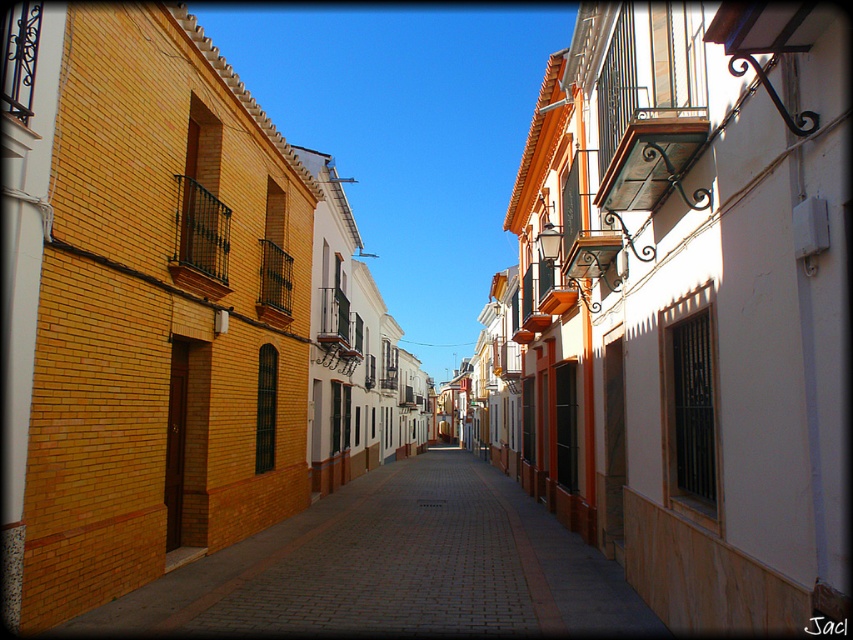
You are a tourist walking along the narrow cobblestone alleyway in this Mediterranean town. You notice a white textured wall at center and a brick pavement at center. Which object is located to the right of the other?

The white textured wall at center is positioned on the right side of brick pavement at center, so the white textured wall at center is to the right of the brick pavement at center.

You are standing on the cobblestone alleyway in the Mediterranean town. You want to take a photo of the white textured wall at center. Where should you position yourself to capture it in the frame?

To capture the white textured wall at center in your photo, position yourself so that the camera is aimed at the coordinates approximately at point 0.477 on the horizontal axis and 0.809 on the vertical axis, as this is the 2D location of the white textured wall at center.

You are a painter wanting to capture the scene. You have a canvas that can only fit objects of equal width. Which object between the white textured wall at center and the brick pavement at center should you choose to paint so it fits your canvas?

The white textured wall at center has a lesser width compared to brick pavement at center, so you should choose the white textured wall at center to paint as it fits the canvas requiring equal width.